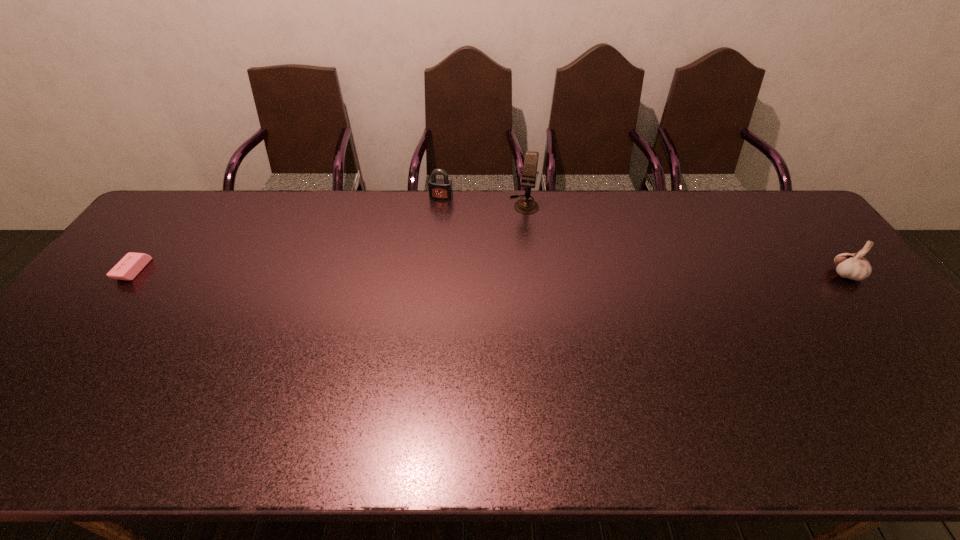
Locate an element on the screen. This screenshot has height=540, width=960. free space at the right edge is located at coordinates (801, 267).

Where is `vacant space at the near left corner`? The image size is (960, 540). vacant space at the near left corner is located at coordinates (55, 380).

In the image, there is a desktop. Where is `vacant space at the far right corner`? The width and height of the screenshot is (960, 540). vacant space at the far right corner is located at coordinates (780, 199).

I want to click on free space that is in between the eraser and the padlock, so [287, 234].

At what (x,y) coordinates should I click in order to perform the action: click on free point between the padlock and the second object from right to left. Please return your answer as a coordinate pair (x, y). This screenshot has height=540, width=960. Looking at the image, I should click on (483, 201).

You are a GUI agent. You are given a task and a screenshot of the screen. Output one action in this format:
    pyautogui.click(x=<x>, y=<y>)
    Task: Click on the unoccupied position between the garlic and the tallest object
    The image size is (960, 540).
    Given the screenshot: What is the action you would take?
    pyautogui.click(x=685, y=240)

This screenshot has width=960, height=540. What are the coordinates of `blank region between the tallest object and the second object from left to right` in the screenshot? It's located at (483, 201).

Identify the location of empty space that is in between the garlic and the leftmost object. The height and width of the screenshot is (540, 960). (490, 273).

Where is `free space between the third object from right to left and the shortest object`? free space between the third object from right to left and the shortest object is located at coordinates (287, 234).

Locate an element on the screen. This screenshot has height=540, width=960. vacant space that's between the padlock and the eraser is located at coordinates tap(287, 234).